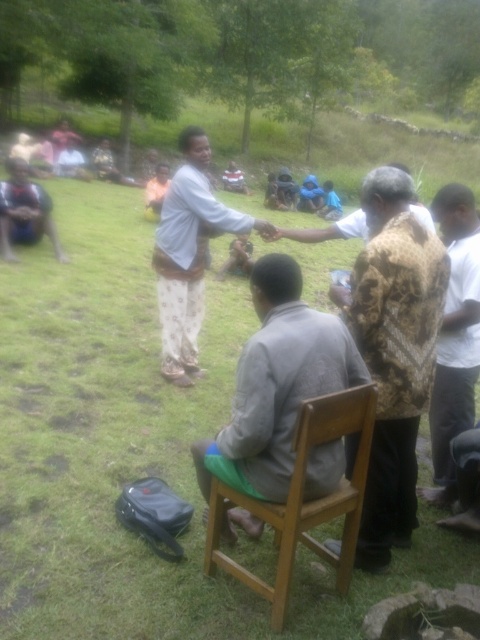
Question: Is green grass at center closer to the viewer compared to patterned fabric shirt at right?

Choices:
 (A) yes
 (B) no

Answer: (A)

Question: Estimate the real-world distances between objects in this image. Which object is closer to the patterned fabric shirt at right?

Choices:
 (A) wooden chair at center
 (B) green grass at center

Answer: (A)

Question: Among these points, which one is nearest to the camera?

Choices:
 (A) (208, 204)
 (B) (372, 518)

Answer: (B)

Question: Among these points, which one is farthest from the camera?

Choices:
 (A) (373, 588)
 (B) (422, 348)
 (C) (230, 419)

Answer: (C)

Question: Observing the image, what is the correct spatial positioning of green grass at center in reference to patterned fabric shirt at right?

Choices:
 (A) left
 (B) right

Answer: (A)

Question: Is gray fabric shirt at center positioned before light gray shirt at center?

Choices:
 (A) no
 (B) yes

Answer: (B)